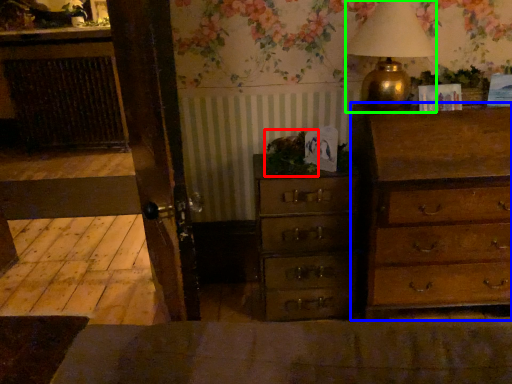
Question: Which object is the closest to the plant (highlighted by a red box)? Choose among these: chest of drawers (highlighted by a blue box) or table lamp (highlighted by a green box).

Choices:
 (A) chest of drawers
 (B) table lamp

Answer: (B)